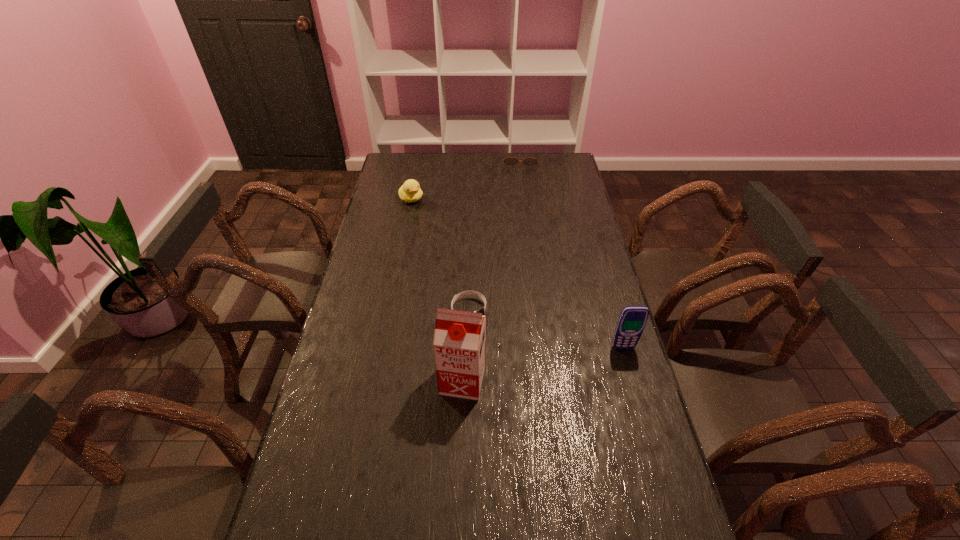
Image resolution: width=960 pixels, height=540 pixels. What are the coordinates of `vacant space on the desktop that is between the nearest object and the second nearest object and is positioned at the beak of the leftmost object` in the screenshot? It's located at (555, 362).

Find the location of a particular element. The image size is (960, 540). vacant space on the desktop that is between the tallest object and the fourth shortest object and is positioned on the outer surface of the third farthest object is located at coordinates (529, 367).

Find the location of a particular element. free space on the desktop that is between the tallest object and the rightmost object and is positioned on the face of the fourth object from left to right is located at coordinates (530, 367).